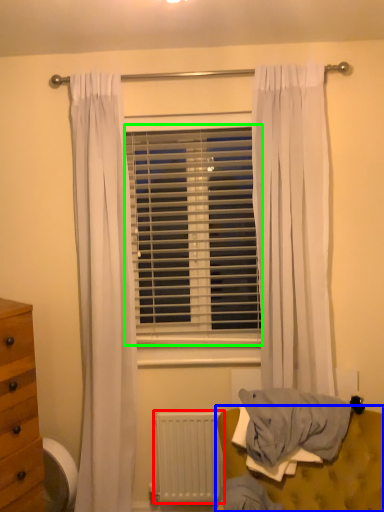
Question: Which object is positioned closest to radiator (highlighted by a red box)? Select from furniture (highlighted by a blue box) and window blind (highlighted by a green box).

Choices:
 (A) furniture
 (B) window blind

Answer: (A)